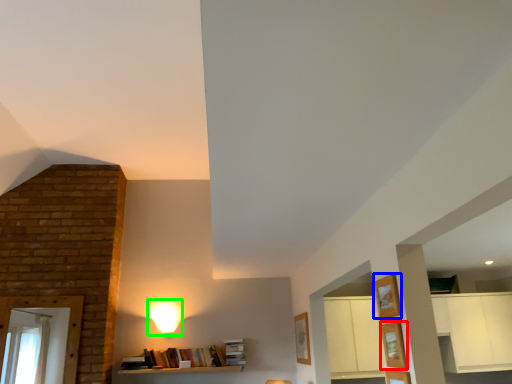
Question: Which object is positioned farthest from shelf (highlighted by a red box)? Select from shelf (highlighted by a blue box) and lamp (highlighted by a green box).

Choices:
 (A) shelf
 (B) lamp

Answer: (B)